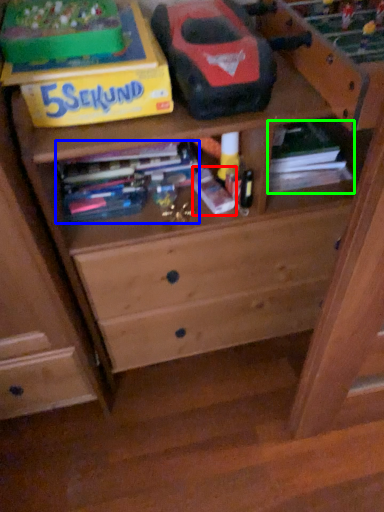
Question: Estimate the real-world distances between objects in this image. Which object is closer to book (highlighted by a red box), book (highlighted by a blue box) or book (highlighted by a green box)?

Choices:
 (A) book
 (B) book

Answer: (A)